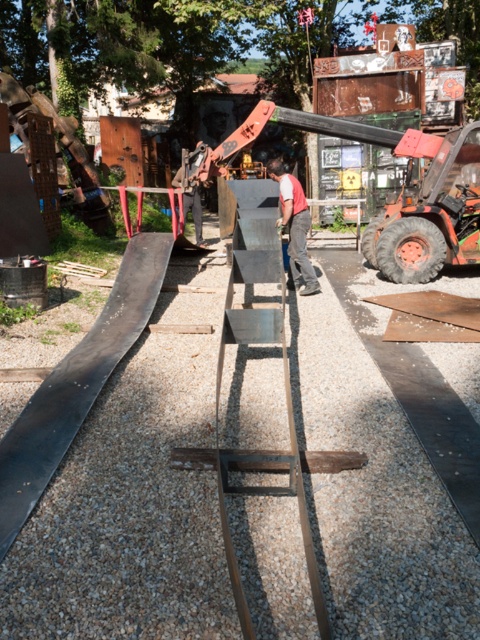
You are a construction worker who needs to climb the metallic gray ladder at center to reach the top of a structure. However, you notice the red cotton shirt at center nearby. Is the ladder tall enough for you to climb safely without the shirt getting in your way?

The metallic gray ladder at center has a larger size compared to red cotton shirt at center, so the ladder is taller than the shirt. Since the shirt is smaller, it won not obstruct your climb. You can safely climb the ladder.

You are a worker at the construction site and need to reach the top of the metallic gray ladder at center. However, there is a rusty metal forklift at center in your way. Can you climb the ladder without moving the forklift?

The metallic gray ladder at center is located below the rusty metal forklift at center, so the ladder is underneath the forklift. This means the ladder is blocked by the forklift and you cannot climb it without moving the forklift first.

You are standing at the origin point of the coordinate system in this scene. The metallic gray ladder at center is located at point 0.581, 0.590. If you want to move towards the ladder, which direction should you head?

The metallic gray ladder at center is located at point (283, 371), so you should move towards the center of the scene to reach it.